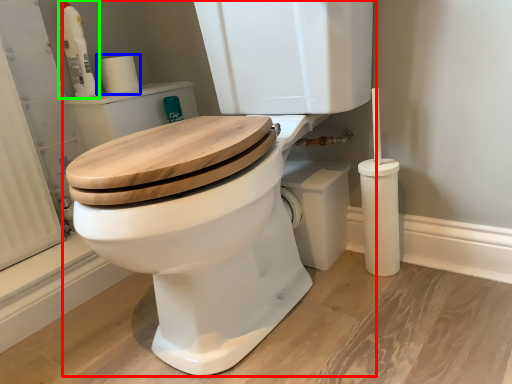
Question: Estimate the real-world distances between objects in this image. Which object is farther from toilet (highlighted by a red box), toilet paper (highlighted by a blue box) or cleaning product (highlighted by a green box)?

Choices:
 (A) toilet paper
 (B) cleaning product

Answer: (B)